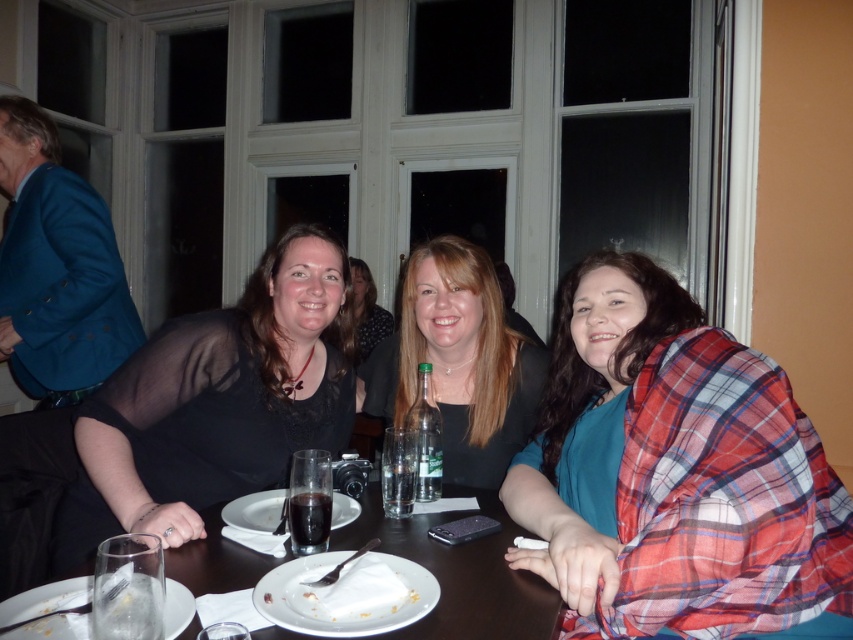
Between plaid fabric scarf at center and white ceramic plate at lower left, which one appears on the left side from the viewer's perspective?

Positioned to the left is white ceramic plate at lower left.

You are a GUI agent. You are given a task and a screenshot of the screen. Output one action in this format:
    pyautogui.click(x=<x>, y=<y>)
    Task: Click on the plaid fabric scarf at center
    Image resolution: width=853 pixels, height=640 pixels.
    Given the screenshot: What is the action you would take?
    pyautogui.click(x=672, y=468)

Between point (833, 492) and point (73, 612), which one is positioned in front?

Positioned in front is point (73, 612).

Find the location of `plaid fabric scarf at center`. plaid fabric scarf at center is located at coordinates (672, 468).

Is black lace dress at center smaller than white matte plate at center?

Actually, black lace dress at center might be larger than white matte plate at center.

Does point (218, 330) come farther from viewer compared to point (376, 552)?

Yes.

Identify the location of black lace dress at center. coord(215,403).

Image resolution: width=853 pixels, height=640 pixels. Describe the element at coordinates (45, 598) in the screenshot. I see `white ceramic plate at lower left` at that location.

How far apart are white ceramic plate at lower left and white ceramic plate at center?

white ceramic plate at lower left and white ceramic plate at center are 33.11 centimeters apart.

This screenshot has height=640, width=853. What are the coordinates of `white ceramic plate at lower left` in the screenshot? It's located at (45, 598).